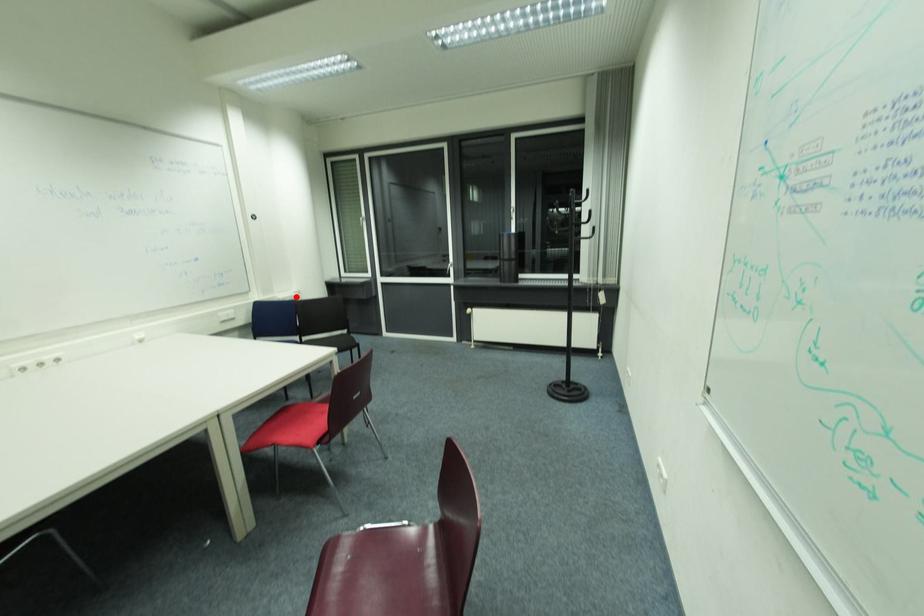
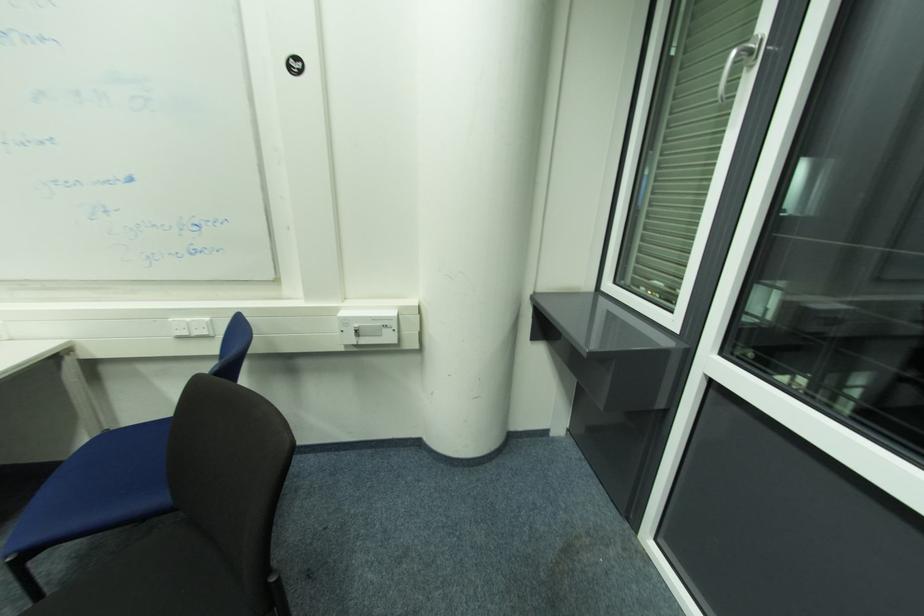
Find the pixel in the second image that matches the highlighted location in the first image.

(378, 320)